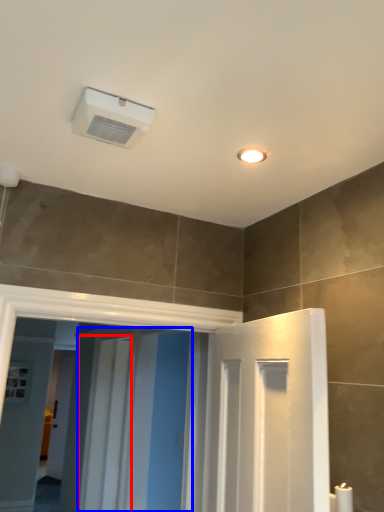
Question: Among these objects, which one is farthest to the camera, screen door (highlighted by a red box) or screen door (highlighted by a blue box)?

Choices:
 (A) screen door
 (B) screen door

Answer: (A)